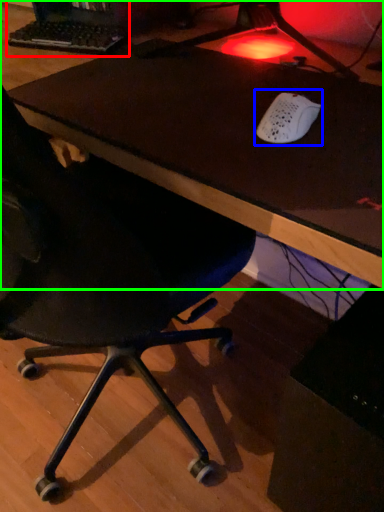
Question: Based on their relative distances, which object is farther from desktop computer (highlighted by a red box)? Choose from mouse (highlighted by a blue box) and table (highlighted by a green box).

Choices:
 (A) mouse
 (B) table

Answer: (A)